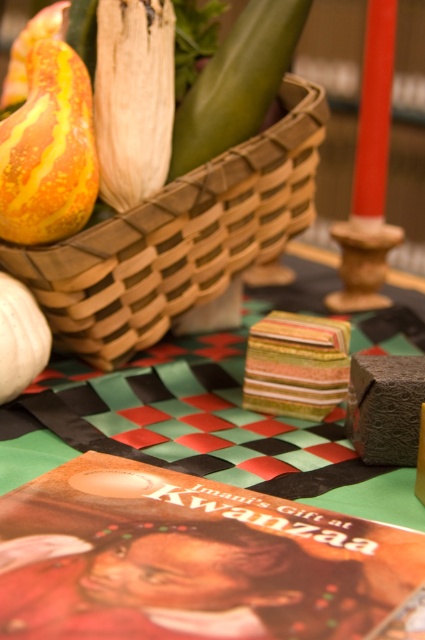
You are preparing to place a decorative item on the table for Kwanzaa. You have a striped paper napkin at center and a green smooth vegetable at upper center. Where should you place the new item so it doesn not block the view of both objects?

Place the new item between the striped paper napkin at center and the green smooth vegetable at upper center, since the striped paper napkin at center is below the green smooth vegetable at upper center, so positioning it in between would avoid blocking either.

What is located at the point with coordinates (x=197, y=512)?

The point at coordinates (x=197, y=512) corresponds to the striped paper napkin at center.